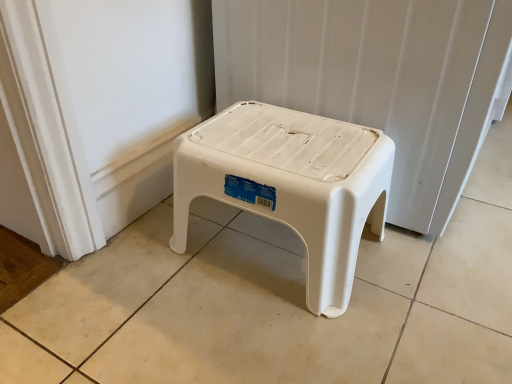
Question: From a real-world perspective, is white plastic stool at center positioned above or below white plastic stool at center?

Choices:
 (A) below
 (B) above

Answer: (A)

Question: Does point (349, 127) appear closer or farther from the camera than point (471, 13)?

Choices:
 (A) closer
 (B) farther

Answer: (B)

Question: Is white plastic stool at center to the left or to the right of white plastic stool at center in the image?

Choices:
 (A) right
 (B) left

Answer: (B)

Question: Considering the relative positions of white plastic stool at center and white plastic stool at center in the image provided, is white plastic stool at center to the left or to the right of white plastic stool at center?

Choices:
 (A) left
 (B) right

Answer: (B)

Question: Considering the positions of point (408, 49) and point (309, 210), is point (408, 49) closer or farther from the camera than point (309, 210)?

Choices:
 (A) closer
 (B) farther

Answer: (B)

Question: From the image's perspective, is white plastic stool at center positioned above or below white plastic stool at center?

Choices:
 (A) below
 (B) above

Answer: (B)

Question: Is white plastic stool at center bigger or smaller than white plastic stool at center?

Choices:
 (A) big
 (B) small

Answer: (A)